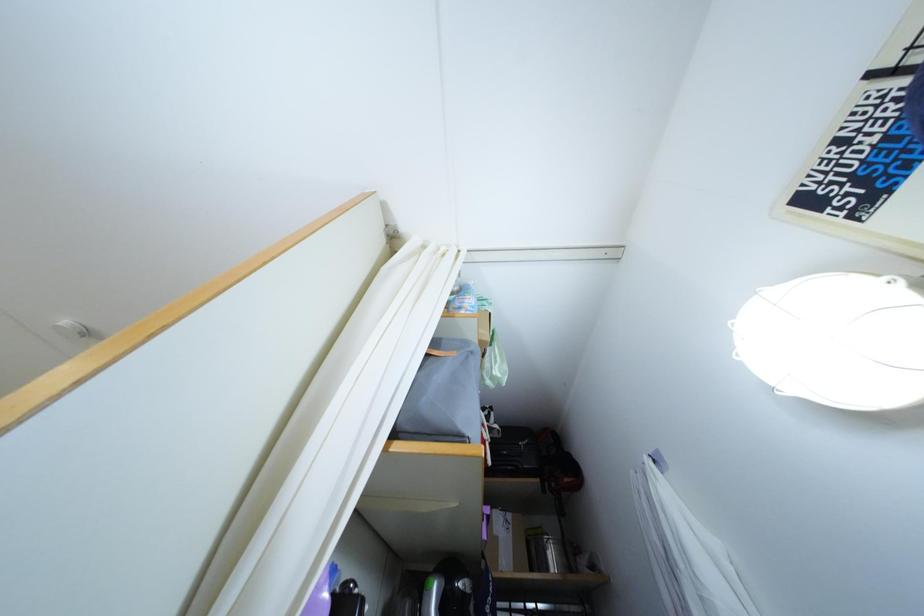
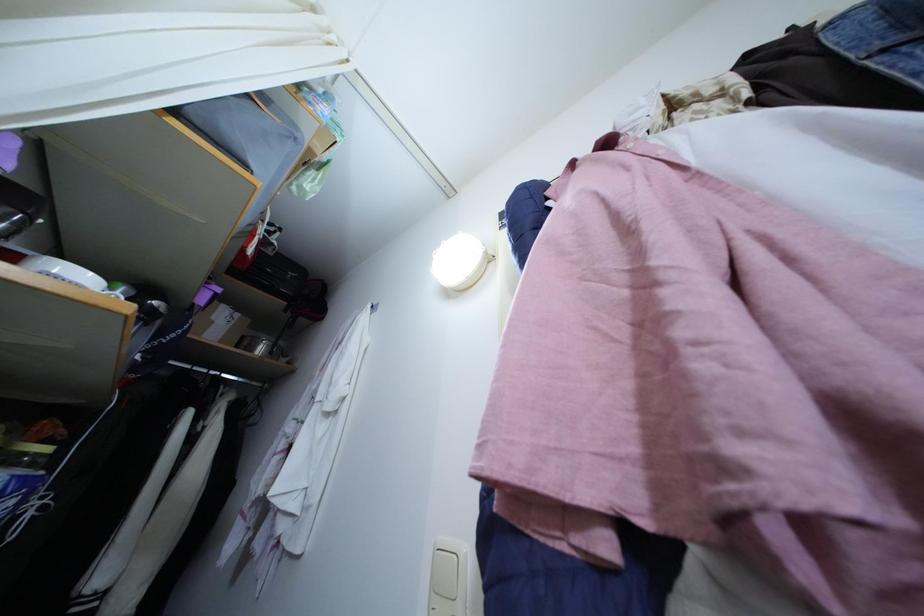
Question: Based on the continuous images, in which direction is the camera rotating? Reply with the corresponding letter.

Choices:
 (A) Left
 (B) Right
 (C) Up
 (D) Down

Answer: (B)